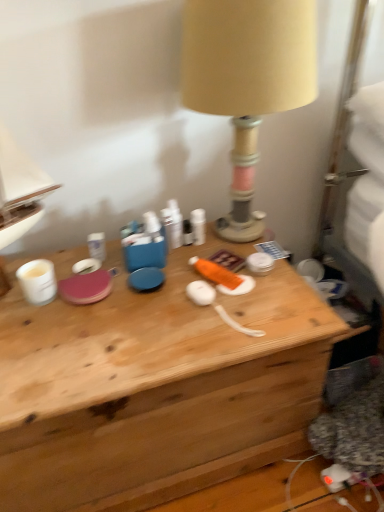
Question: From their relative heights in the image, would you say beige fabric lampshade at upper center is taller or shorter than wooden desk at center?

Choices:
 (A) tall
 (B) short

Answer: (A)

Question: Considering the relative positions of beige fabric lampshade at upper center and wooden desk at center in the image provided, is beige fabric lampshade at upper center to the left or to the right of wooden desk at center?

Choices:
 (A) left
 (B) right

Answer: (B)

Question: Is point (228, 88) positioned closer to the camera than point (208, 433)?

Choices:
 (A) closer
 (B) farther

Answer: (A)

Question: Is wooden desk at center to the left or to the right of beige fabric lampshade at upper center in the image?

Choices:
 (A) left
 (B) right

Answer: (A)

Question: In terms of size, does wooden desk at center appear bigger or smaller than beige fabric lampshade at upper center?

Choices:
 (A) small
 (B) big

Answer: (B)

Question: From the image's perspective, is wooden desk at center above or below beige fabric lampshade at upper center?

Choices:
 (A) below
 (B) above

Answer: (A)

Question: Is wooden desk at center situated inside beige fabric lampshade at upper center or outside?

Choices:
 (A) inside
 (B) outside

Answer: (B)